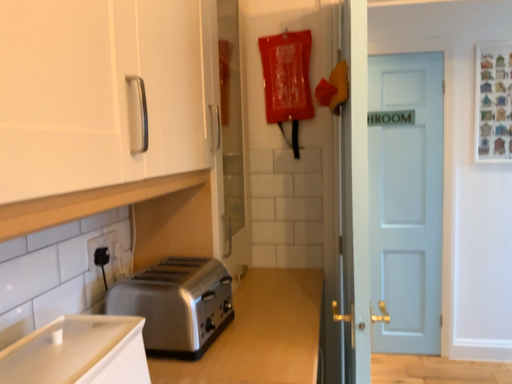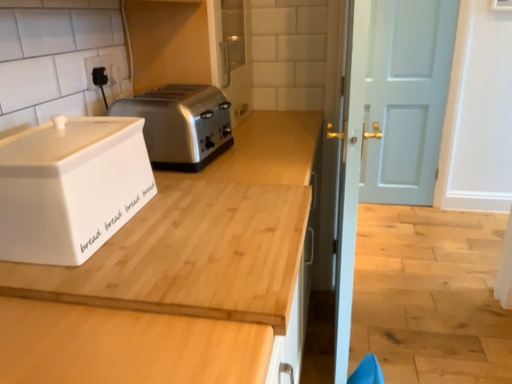
Question: Which way did the camera rotate in the video?

Choices:
 (A) rotated downward
 (B) rotated upward

Answer: (A)